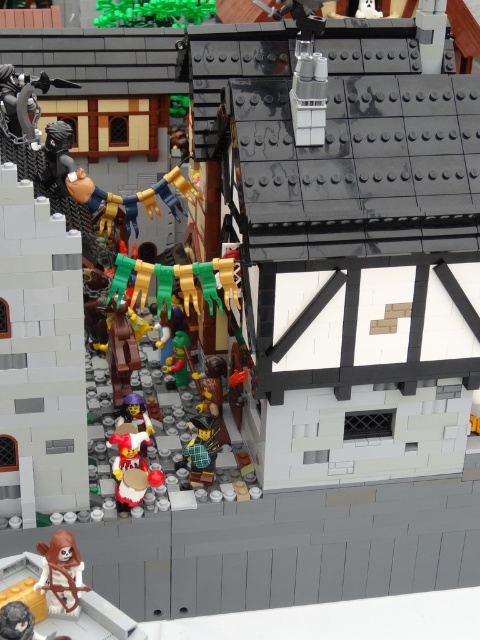
Looking at this image, in the medieval Lego diorama, there is a brown matte figure at lower left and a green plaid shirt at center. Which of these two figures is shorter?

The brown matte figure at lower left is shorter than the green plaid shirt at center.

You are standing in the Lego diorama and want to place a new Lego piece between the two points, point (169,19) and point (212,481). Which point is closer to you so you can start placing the piece there?

Point (169,19) is closer to you than point (212,481), so you should start placing the piece near point (169,19) first.

Please use the coordinate system where the origin is at the bottom left corner of the image. The x and y axes are normalized to the image width and height respectively. The point is at coordinate (154,12). What is the color and material of the object located at this point?

The object at point (154,12) is green matte bricks at upper center, which has a green color and matte material.